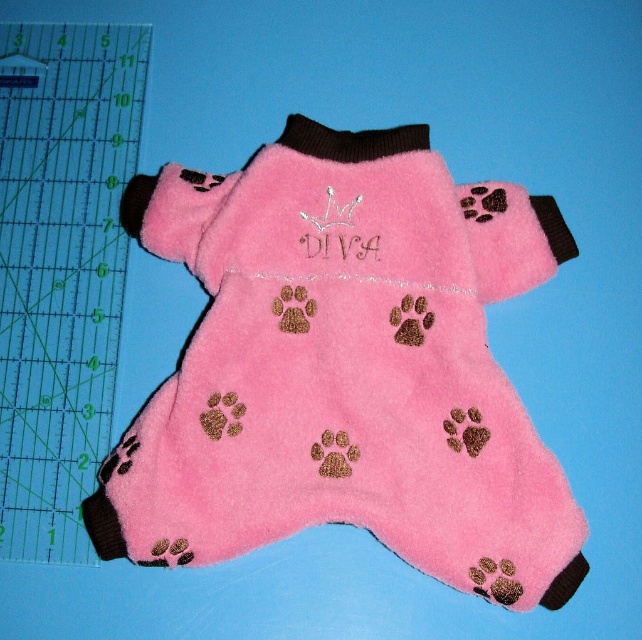
Can you confirm if pink fleece dog coat at center is positioned to the right of transparent plastic ruler at left?

Correct, you'll find pink fleece dog coat at center to the right of transparent plastic ruler at left.

Who is more distant from viewer, (200,401) or (40,33)?

Positioned behind is point (40,33).

Where is `pink fleece dog coat at center`? The width and height of the screenshot is (642, 640). pink fleece dog coat at center is located at coordinates (345, 369).